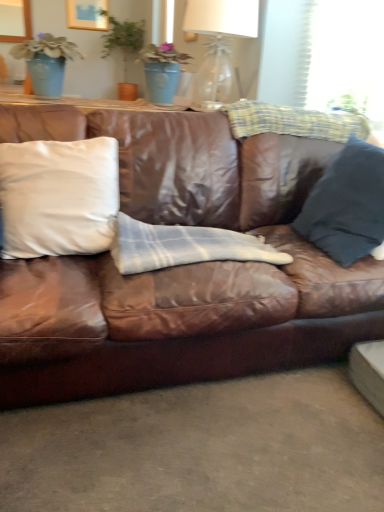
Question: Considering the relative sizes of white matte pillow at left, which appears as the 2th pillow when viewed from the right, and white plaid blanket at center in the image provided, is white matte pillow at left, which appears as the 2th pillow when viewed from the right, shorter than white plaid blanket at center?

Choices:
 (A) no
 (B) yes

Answer: (A)

Question: Does white matte pillow at left, which is the 1th pillow from left to right, turn towards white plaid blanket at center?

Choices:
 (A) no
 (B) yes

Answer: (A)

Question: From a real-world perspective, is white matte pillow at left, which is the 1th pillow from left to right, physically below white plaid blanket at center?

Choices:
 (A) yes
 (B) no

Answer: (B)

Question: Is white matte pillow at left, which appears as the 2th pillow when viewed from the right, not close to white plaid blanket at center?

Choices:
 (A) yes
 (B) no

Answer: (B)

Question: Is white matte pillow at left, which is the 1th pillow from left to right, at the left side of white plaid blanket at center?

Choices:
 (A) no
 (B) yes

Answer: (B)

Question: Is the position of white matte pillow at left, which appears as the 2th pillow when viewed from the right, more distant than that of white plaid blanket at center?

Choices:
 (A) no
 (B) yes

Answer: (A)

Question: From the image's perspective, is white plaid blanket at center below brown leather couch at center?

Choices:
 (A) yes
 (B) no

Answer: (A)

Question: From a real-world perspective, is white plaid blanket at center physically below brown leather couch at center?

Choices:
 (A) no
 (B) yes

Answer: (B)

Question: Is white plaid blanket at center at the right side of brown leather couch at center?

Choices:
 (A) yes
 (B) no

Answer: (B)

Question: From the image's perspective, is white plaid blanket at center on top of brown leather couch at center?

Choices:
 (A) yes
 (B) no

Answer: (B)

Question: Is white plaid blanket at center thinner than brown leather couch at center?

Choices:
 (A) no
 (B) yes

Answer: (B)

Question: Considering the relative sizes of white plaid blanket at center and brown leather couch at center in the image provided, is white plaid blanket at center shorter than brown leather couch at center?

Choices:
 (A) no
 (B) yes

Answer: (B)

Question: From the image's perspective, is brown leather couch at center beneath white matte pillow at left, which appears as the 2th pillow when viewed from the right?

Choices:
 (A) yes
 (B) no

Answer: (A)